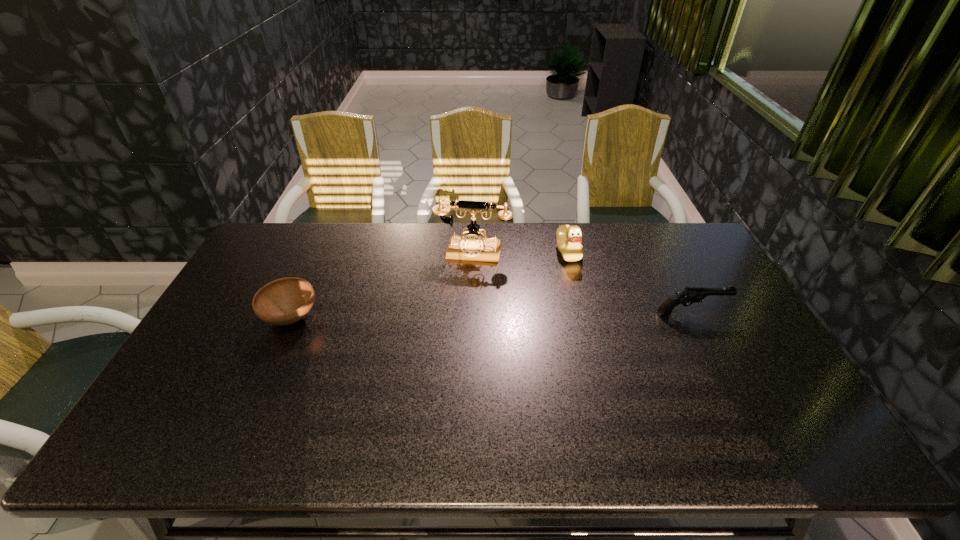
Where is `vacant space located 0.200m on the dial of the tallest object`? Image resolution: width=960 pixels, height=540 pixels. vacant space located 0.200m on the dial of the tallest object is located at coordinates (457, 306).

In order to click on vacant area situated on the dial of the tallest object in this screenshot , I will do `click(464, 280)`.

Image resolution: width=960 pixels, height=540 pixels. What are the coordinates of `vacant space located 0.250m at the beak of the second object from right to left` in the screenshot? It's located at (518, 301).

You are a GUI agent. You are given a task and a screenshot of the screen. Output one action in this format:
    pyautogui.click(x=<x>, y=<y>)
    Task: Click on the free space located at the beak of the second object from right to left
    The height and width of the screenshot is (540, 960).
    Given the screenshot: What is the action you would take?
    pyautogui.click(x=528, y=293)

At what (x,y) coordinates should I click in order to perform the action: click on vacant region located 0.070m at the beak of the second object from right to left. Please return your answer as a coordinate pair (x, y). Image resolution: width=960 pixels, height=540 pixels. Looking at the image, I should click on (551, 272).

In order to click on telephone that is at the far edge in this screenshot , I will do `click(473, 247)`.

Where is `duck that is at the far edge`? duck that is at the far edge is located at coordinates (569, 238).

In order to click on object at the left edge in this screenshot , I will do `click(284, 301)`.

Locate an element on the screen. object positioned at the right edge is located at coordinates (690, 295).

Where is `free space at the far edge of the desktop`? The image size is (960, 540). free space at the far edge of the desktop is located at coordinates (324, 249).